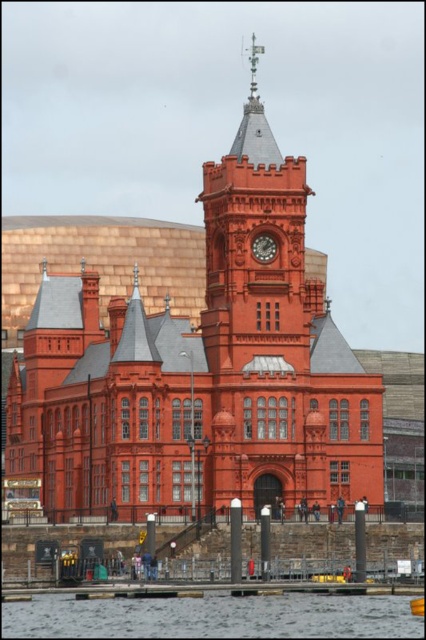
Question: Which point is closer to the camera?

Choices:
 (A) matte red clock at center
 (B) transparent water at lower center

Answer: (B)

Question: Is transparent water at lower center bigger than matte red clock at center?

Choices:
 (A) yes
 (B) no

Answer: (A)

Question: Which point is farther to the camera?

Choices:
 (A) matte red clock at center
 (B) transparent water at lower center

Answer: (A)

Question: Which point is closer to the camera?

Choices:
 (A) matte red clock at center
 (B) transparent water at lower center

Answer: (B)

Question: Considering the relative positions of transparent water at lower center and matte red clock at center in the image provided, where is transparent water at lower center located with respect to matte red clock at center?

Choices:
 (A) above
 (B) below

Answer: (B)

Question: Does transparent water at lower center appear on the right side of matte red clock at center?

Choices:
 (A) no
 (B) yes

Answer: (A)